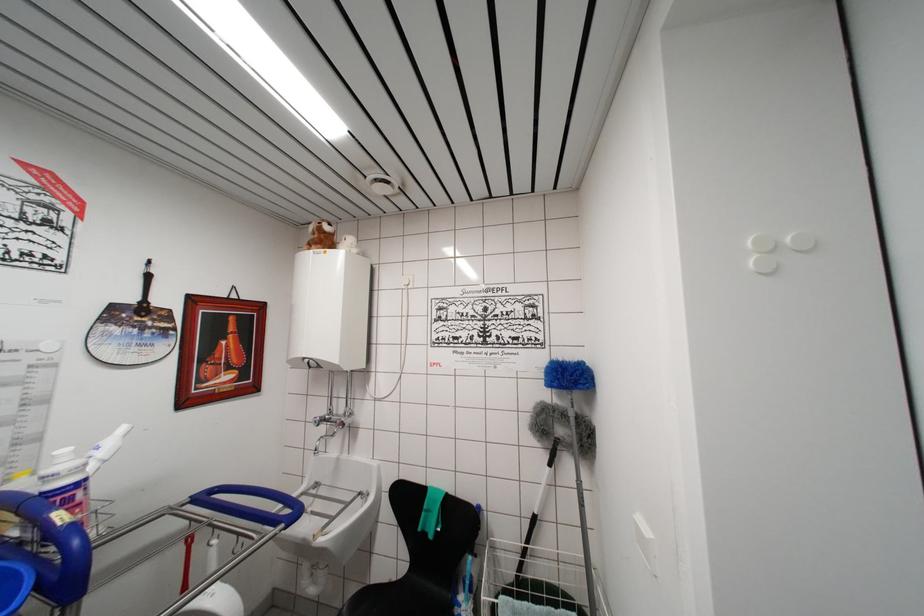
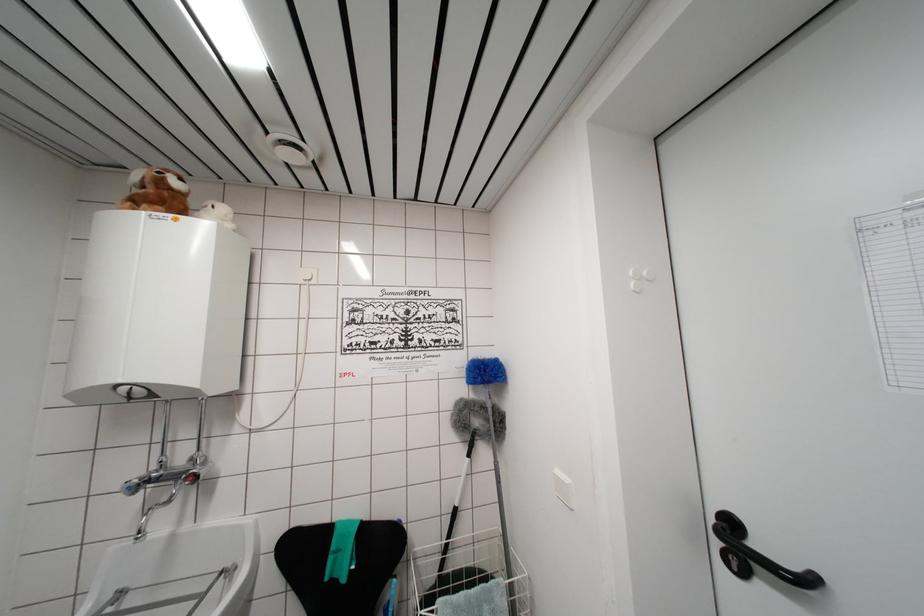
The point at (353, 505) is marked in the first image. Where is the corresponding point in the second image?

(209, 593)